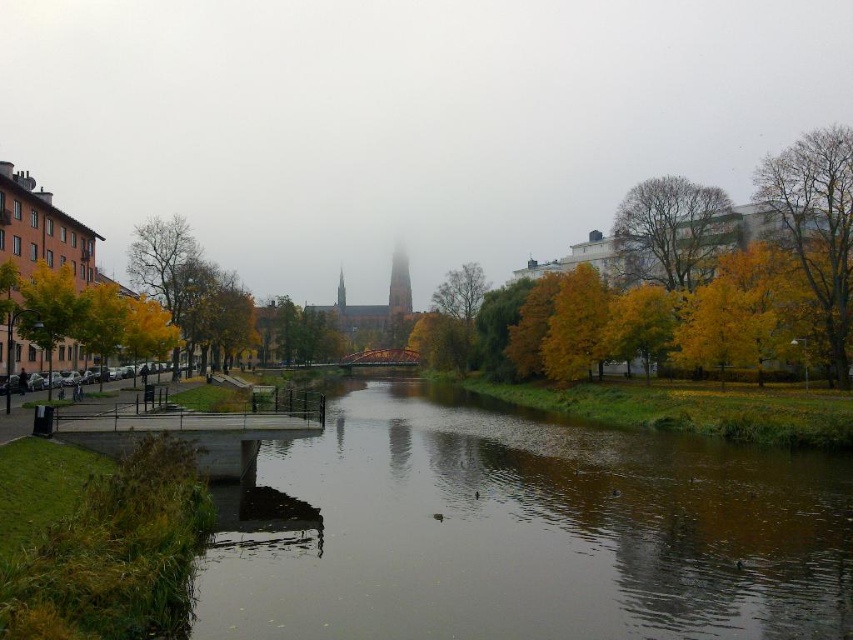
You are a painter setting up your easel along the riverbank. You want to paint both the yellow leafy tree at right and the yellow matte tree at center. Which tree should you move closer to if you want your painting to show the tree as bigger in the canvas?

The yellow leafy tree at right is larger in size than the yellow matte tree at center, so to make the tree appear bigger in the painting, you should move closer to the yellow leafy tree at right.